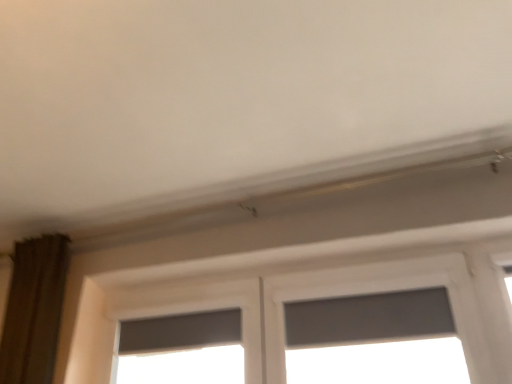
Question: Is gray matte window screen at center in front of or behind matte gray window at center in the image?

Choices:
 (A) front
 (B) behind

Answer: (A)

Question: Considering the positions of gray matte window screen at center and matte gray window at center in the image, is gray matte window screen at center taller or shorter than matte gray window at center?

Choices:
 (A) tall
 (B) short

Answer: (A)

Question: Looking at their shapes, would you say gray matte window screen at center is wider or thinner than matte gray window at center?

Choices:
 (A) thin
 (B) wide

Answer: (B)

Question: Considering the positions of matte gray window at center and gray matte window screen at center in the image, is matte gray window at center taller or shorter than gray matte window screen at center?

Choices:
 (A) tall
 (B) short

Answer: (B)

Question: From the image's perspective, is matte gray window at center above or below gray matte window screen at center?

Choices:
 (A) above
 (B) below

Answer: (B)

Question: Would you say matte gray window at center is to the left or to the right of gray matte window screen at center in the picture?

Choices:
 (A) left
 (B) right

Answer: (A)

Question: Considering their positions, is matte gray window at center located in front of or behind gray matte window screen at center?

Choices:
 (A) behind
 (B) front

Answer: (A)